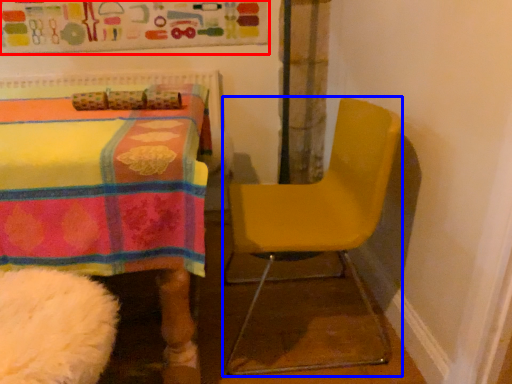
Question: Which point is closer to the camera, bulletin board (highlighted by a red box) or chair (highlighted by a blue box)?

Choices:
 (A) bulletin board
 (B) chair

Answer: (B)